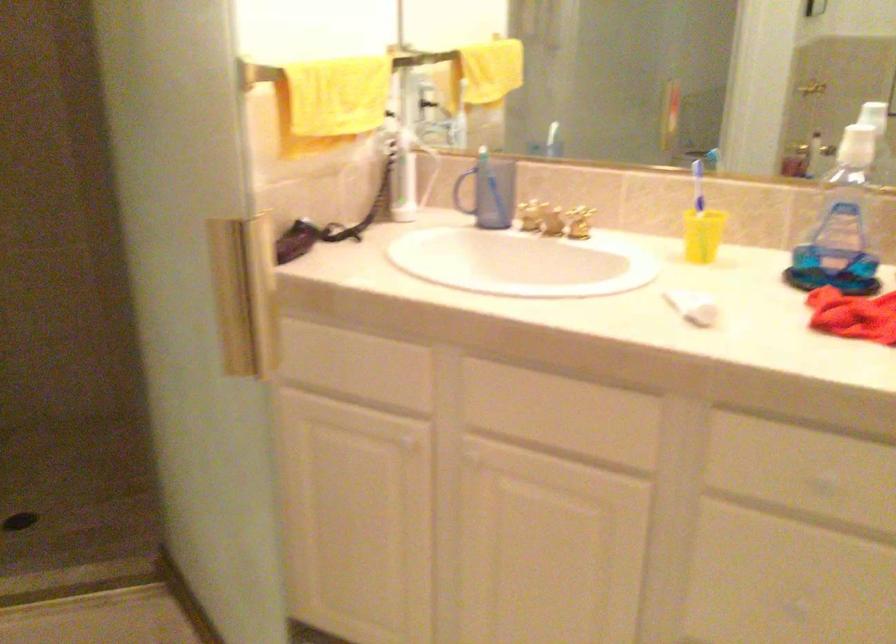
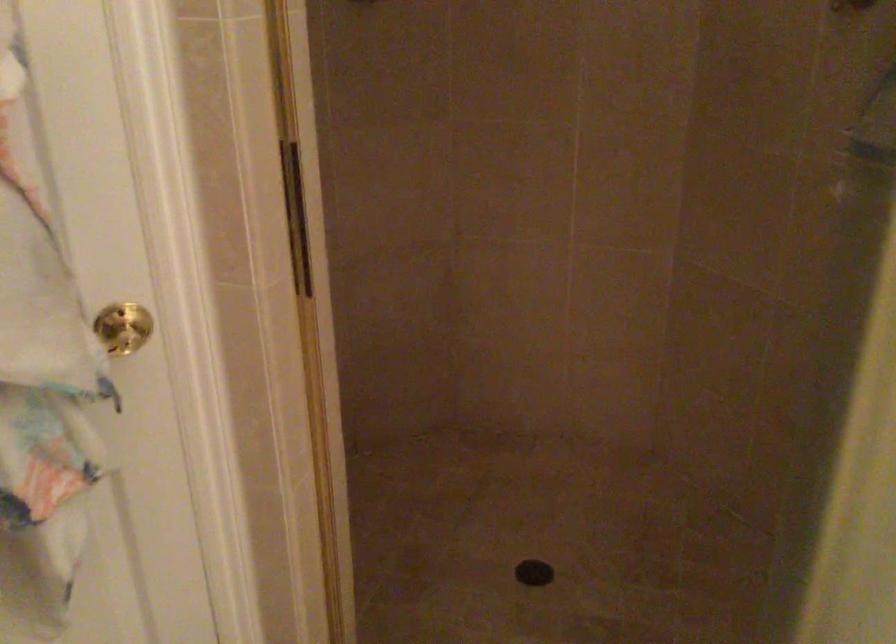
Question: The camera is either moving clockwise (left) or counter-clockwise (right) around the object. The first image is from the beginning of the video and the second image is from the end. Is the camera moving left or right when shooting the video?

Choices:
 (A) Left
 (B) Right

Answer: (B)